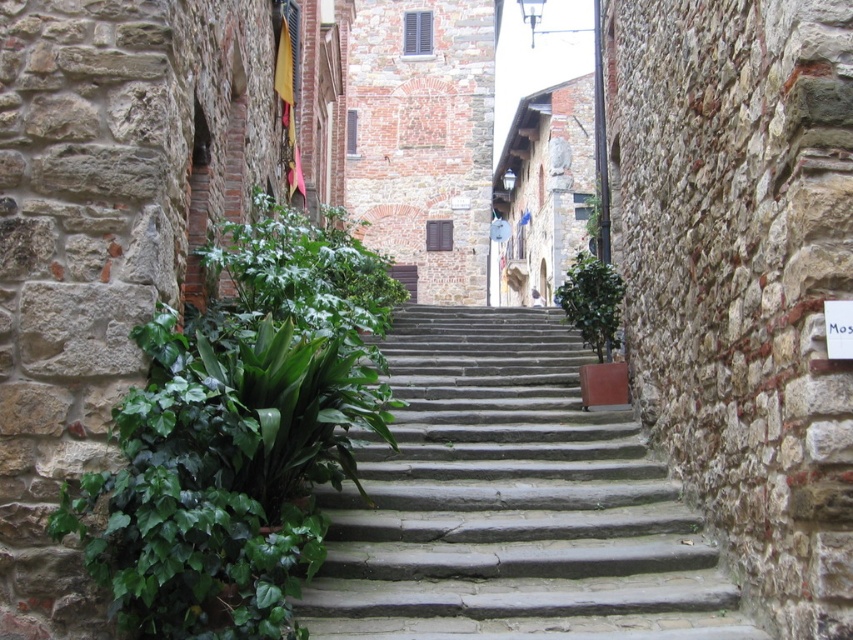
Question: Among these points, which one is nearest to the camera?

Choices:
 (A) (227, 321)
 (B) (495, 349)
 (C) (582, 276)

Answer: (A)

Question: Can you confirm if green leafy plant at left is wider than green glossy bush at center?

Choices:
 (A) yes
 (B) no

Answer: (B)

Question: Based on their relative distances, which object is farther from the green leafy plant at left?

Choices:
 (A) green glossy bush at center
 (B) stone stairs at center

Answer: (A)

Question: Which object is closer to the camera taking this photo?

Choices:
 (A) green glossy bush at center
 (B) green leafy plant at left

Answer: (B)

Question: Is the position of green leafy plant at left less distant than that of green glossy bush at center?

Choices:
 (A) no
 (B) yes

Answer: (B)

Question: Can you confirm if stone stairs at center is thinner than green leafy plant at left?

Choices:
 (A) no
 (B) yes

Answer: (A)